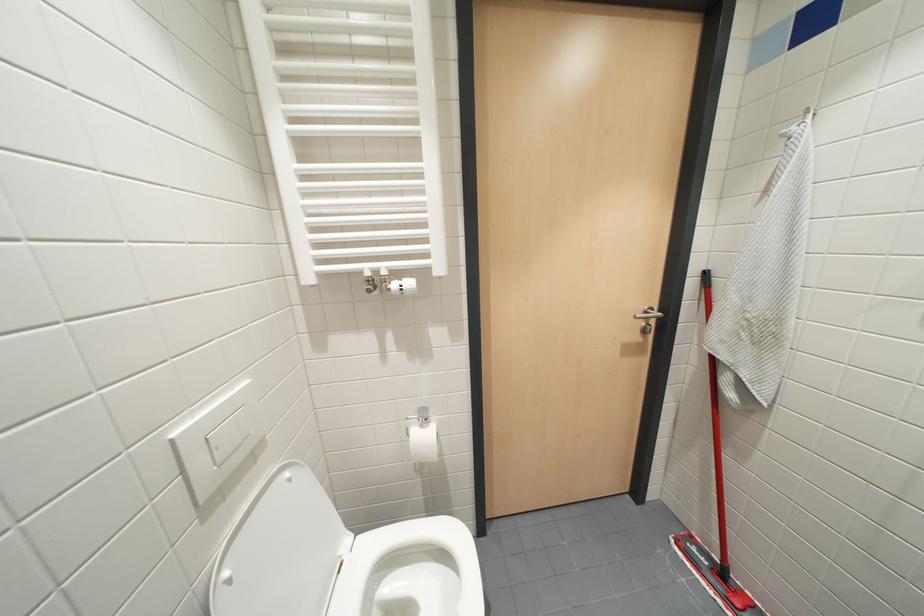
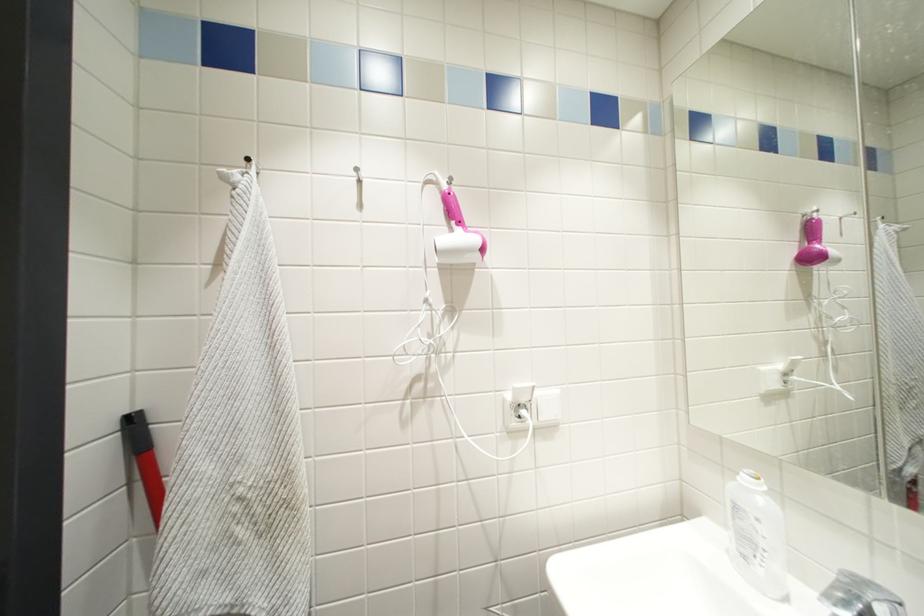
Question: The images are taken continuously from a first-person perspective. In which direction is your viewpoint rotating?

Choices:
 (A) Left
 (B) Right
 (C) Up
 (D) Down

Answer: (B)